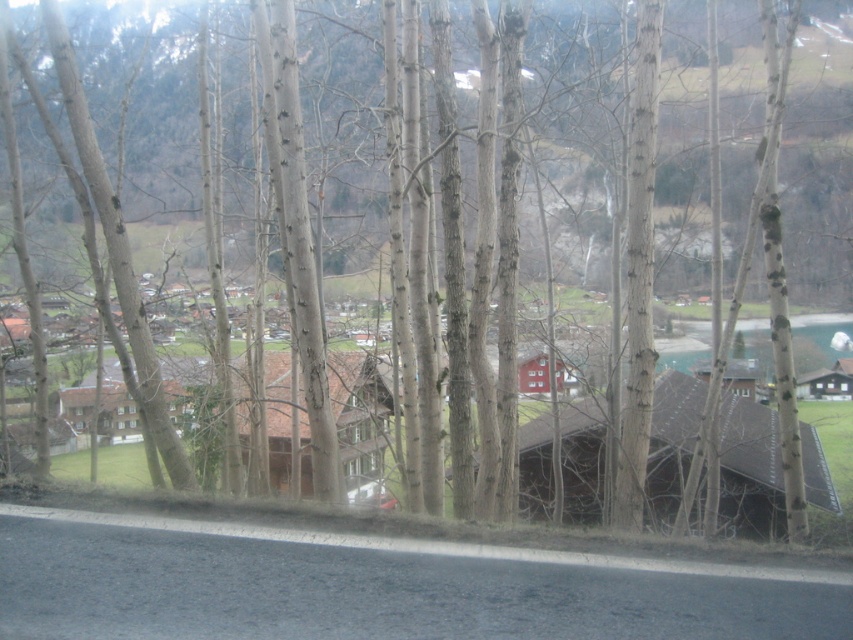
You are standing in the rural landscape scene and want to walk from point A to point B. Point A is located at point [805,387] and point B is at point [381,483]. Since you can only move forward, will you move towards the camera or away from it when going from A to B?

Result: When moving from point A to point B, you will be moving away from the camera because point A is closer to the camera than point B.